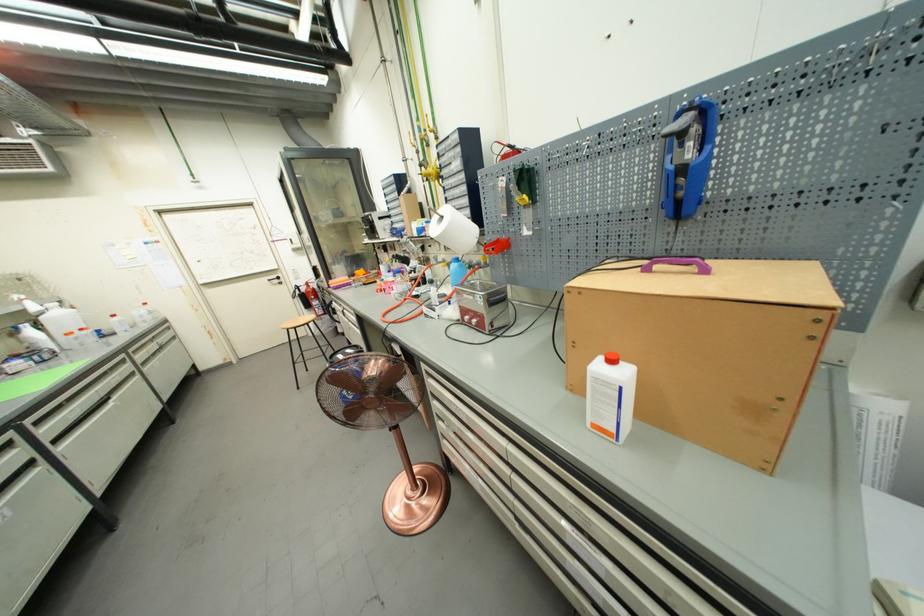
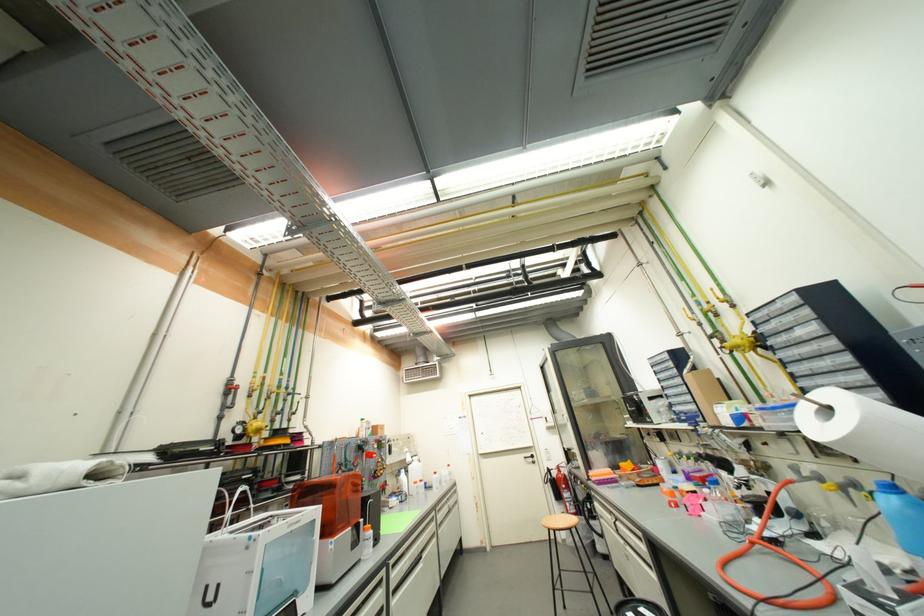
How did the camera likely rotate?

The rotation direction of the camera is left-up.